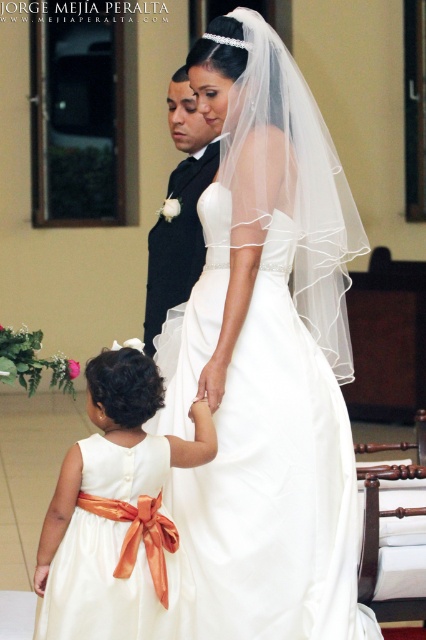
Based on the photo, between white satin dress at center and white satin dress at lower left, which one has more height?

white satin dress at center is taller.

Can you confirm if white satin dress at center is positioned to the left of white satin dress at lower left?

In fact, white satin dress at center is to the right of white satin dress at lower left.

Does point (344, 252) lie in front of point (115, 522)?

No.

Where is `white satin dress at center`? The image size is (426, 640). white satin dress at center is located at coordinates (267, 356).

Is white satin dress at lower left taller than black satin suit at center?

No.

I want to click on white satin dress at lower left, so click(115, 512).

Who is more forward, (x=212, y=243) or (x=161, y=288)?

Point (x=212, y=243) is more forward.

Can you confirm if white satin dress at center is taller than black satin suit at center?

Yes, white satin dress at center is taller than black satin suit at center.

Where is `white satin dress at center`? white satin dress at center is located at coordinates (267, 356).